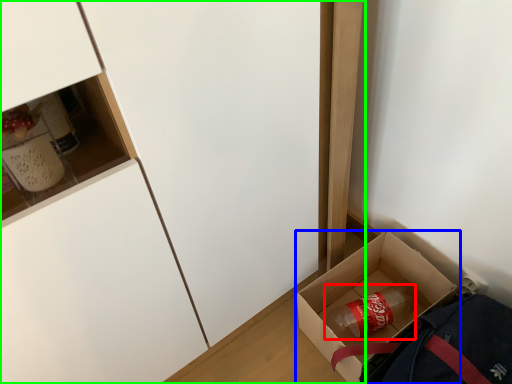
Question: Which object is the farthest from beverage (highlighted by a red box)? Choose among these: box (highlighted by a blue box) or cabinetry (highlighted by a green box).

Choices:
 (A) box
 (B) cabinetry

Answer: (B)